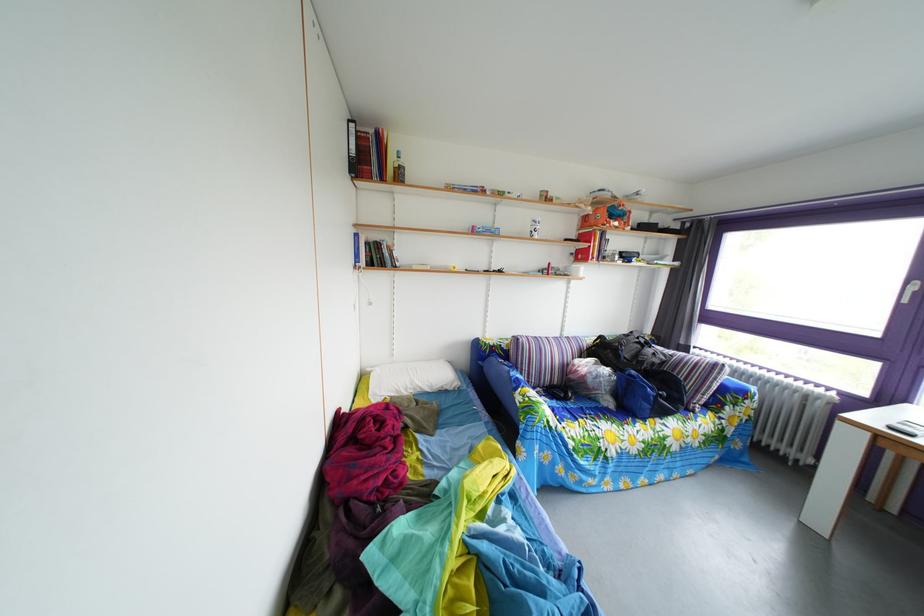
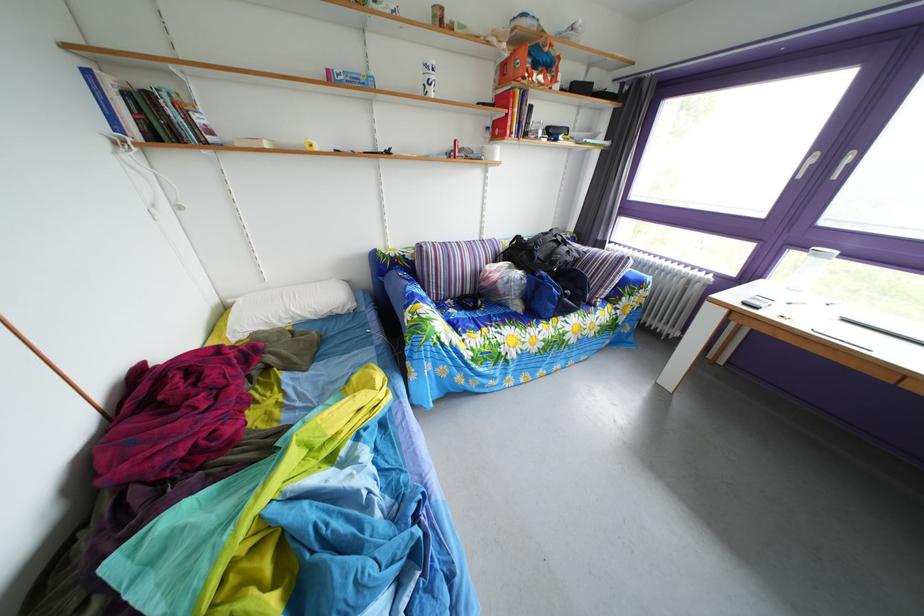
The point at (x=582, y=262) is marked in the first image. Where is the corresponding point in the second image?

(499, 137)